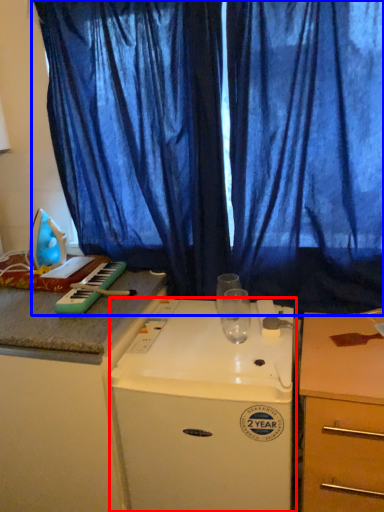
Question: Which object is further to the camera taking this photo, home appliance (highlighted by a red box) or curtain (highlighted by a blue box)?

Choices:
 (A) home appliance
 (B) curtain

Answer: (B)